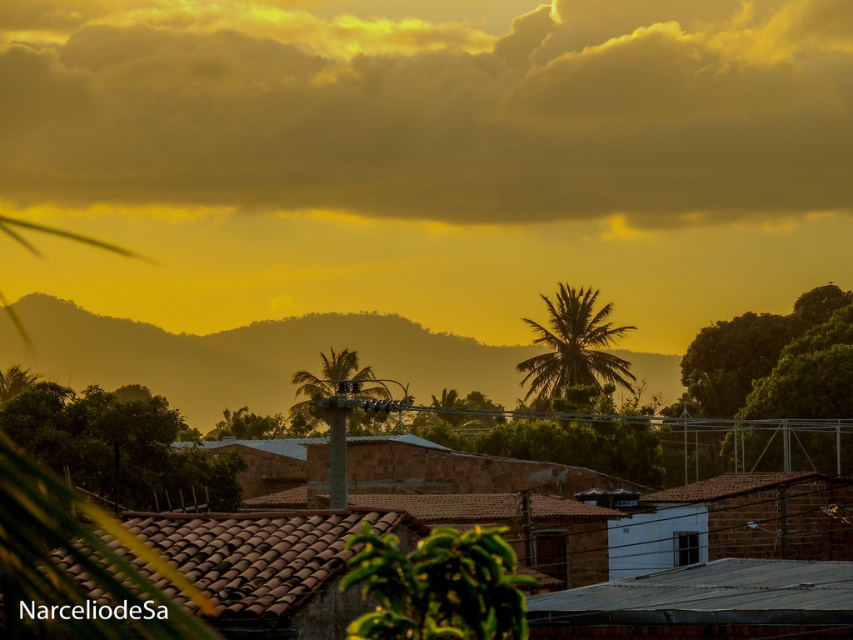
Question: Can you confirm if cloudy textured sky at upper center is smaller than green leafy palm at center?

Choices:
 (A) no
 (B) yes

Answer: (A)

Question: Does green leafy palm at center appear under green leafy palm tree at center?

Choices:
 (A) yes
 (B) no

Answer: (B)

Question: Which point is farther from the camera taking this photo?

Choices:
 (A) (332, 477)
 (B) (532, 369)

Answer: (B)

Question: Which of the following is the closest to the observer?

Choices:
 (A) (323, 401)
 (B) (585, 301)
 (C) (375, 163)

Answer: (A)

Question: Which of the following is the closest to the observer?

Choices:
 (A) cloudy textured sky at upper center
 (B) green leafy palm tree at center
 (C) green leafy palm at center

Answer: (B)

Question: Does green leafy palm at center appear over green leafy palm tree at center?

Choices:
 (A) no
 (B) yes

Answer: (B)